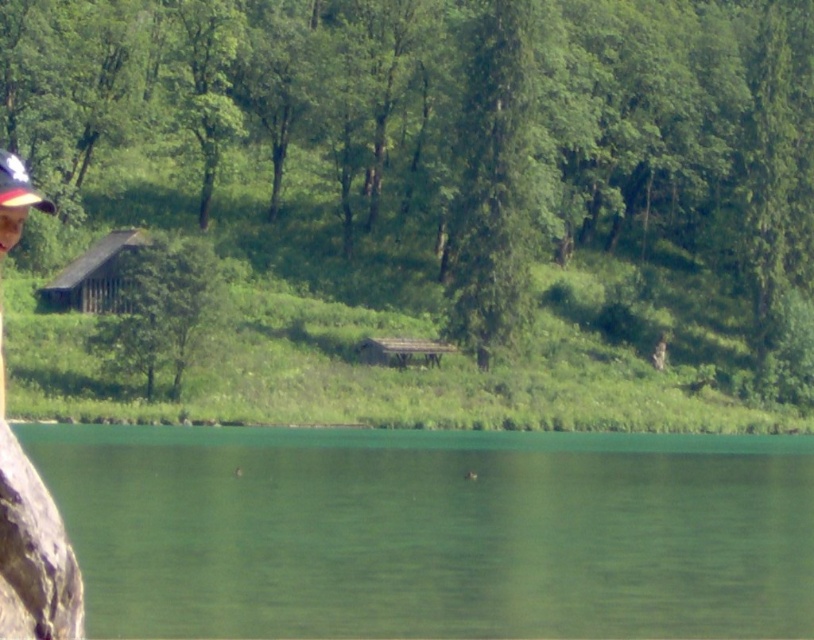
You are a hiker who wants to place a 30 feet long tent between the camouflage hat at left and the white matte baseball cap at upper left. Is there enough space for the tent?

The distance between the camouflage hat at left and the white matte baseball cap at upper left is 41.53 feet, so yes, there is enough space to place a 30 feet long tent between them.

You are standing at the origin point of the coordinate system. You want to walk to the green liquid water at lower center. What are the coordinates you need to reach?

The coordinates to reach the green liquid water at lower center are 0.831 in the x direction and 0.533 in the y direction.

You are standing at the point labeled point (432, 531) in the image. What type of surface are you currently standing on?

The point (432, 531) corresponds to green liquid water at lower center, so you are standing on water.